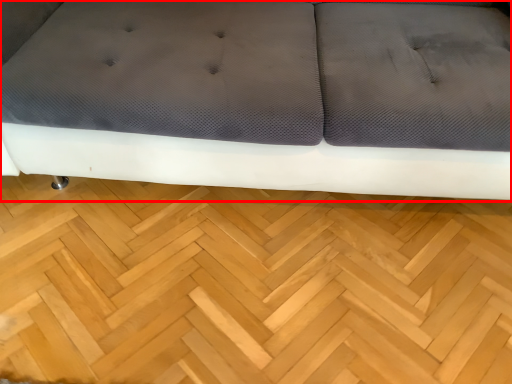
Question: In this image, where is studio couch (annotated by the red box) located relative to hardwood?

Choices:
 (A) right
 (B) left

Answer: (A)